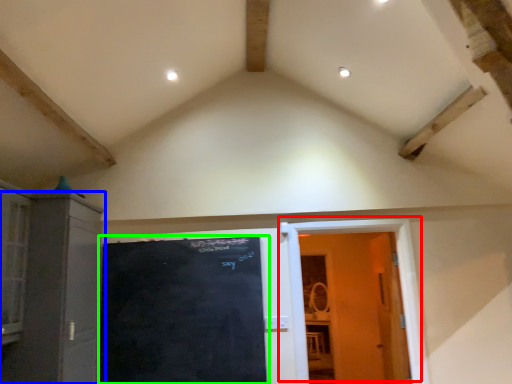
Question: Based on their relative distances, which object is nearer to door (highlighted by a red box)? Choose from cabinetry (highlighted by a blue box) and bulletin board (highlighted by a green box).

Choices:
 (A) cabinetry
 (B) bulletin board

Answer: (B)